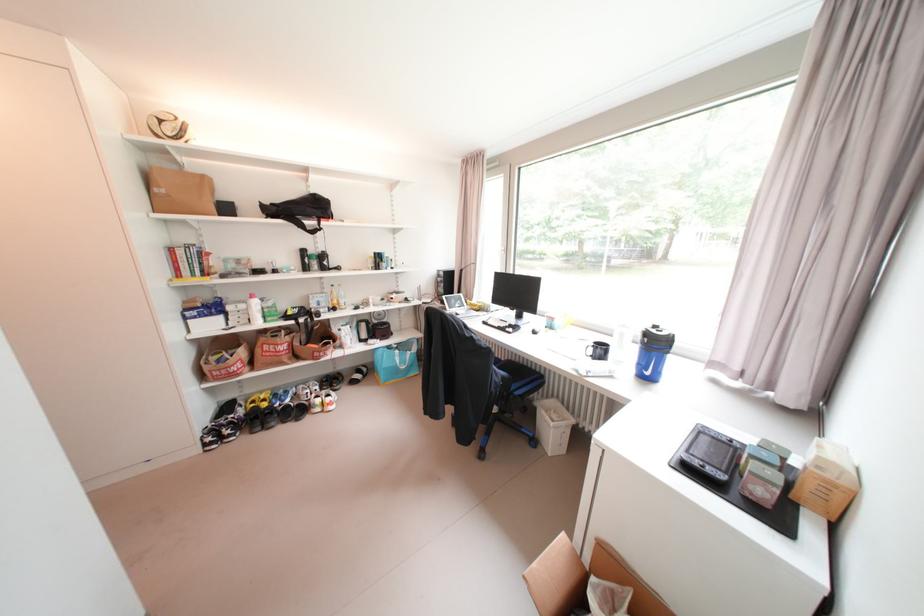
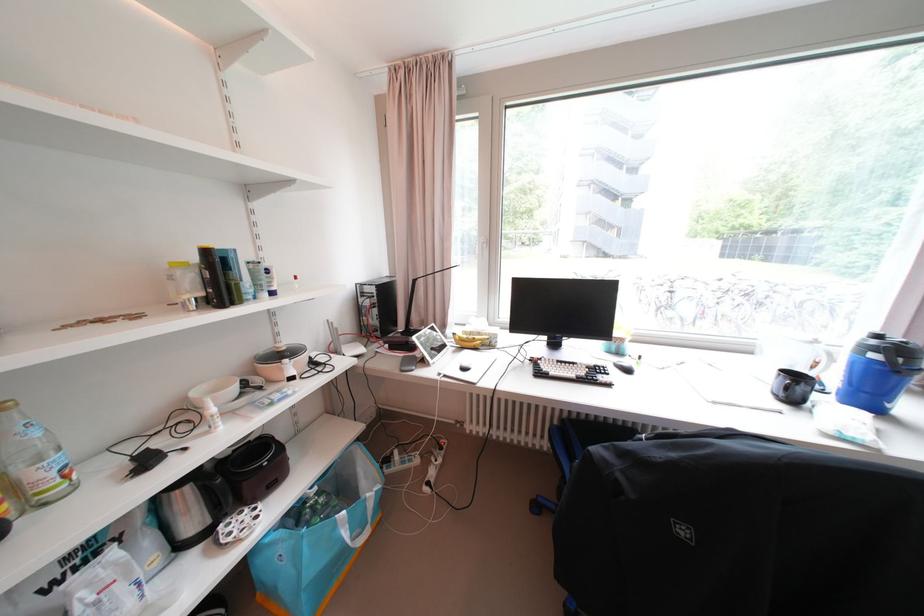
Find the pixel in the second image that matches pixel 450 306 in the first image.

(409, 355)